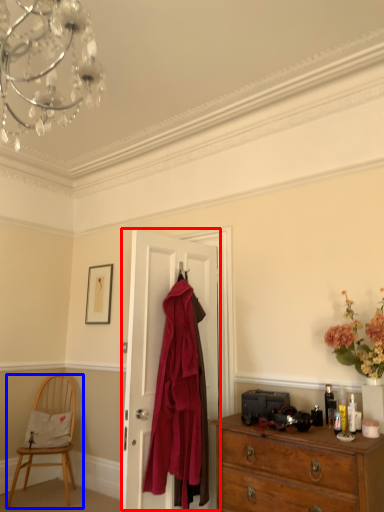
Question: Which point is further to the camera, door (highlighted by a red box) or chair (highlighted by a blue box)?

Choices:
 (A) door
 (B) chair

Answer: (B)